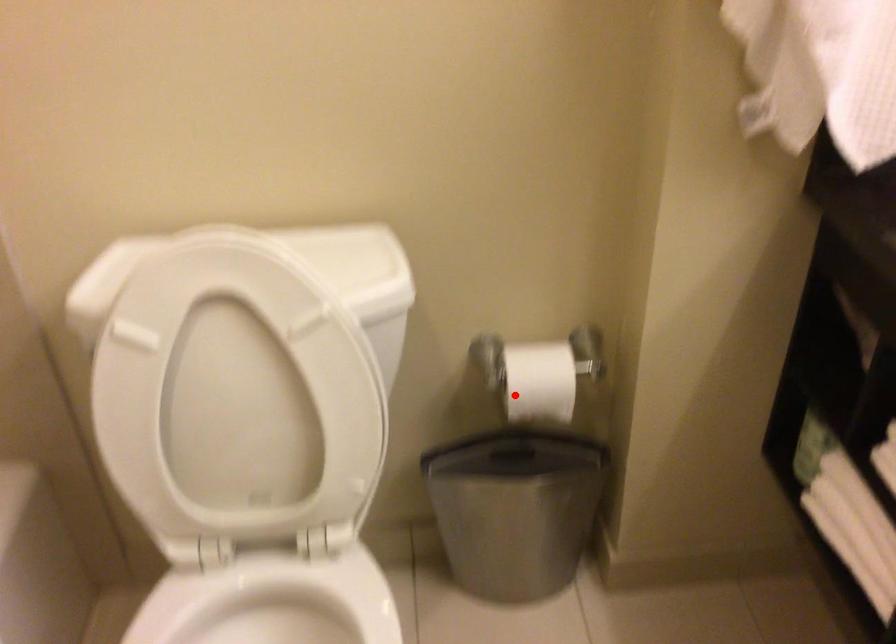
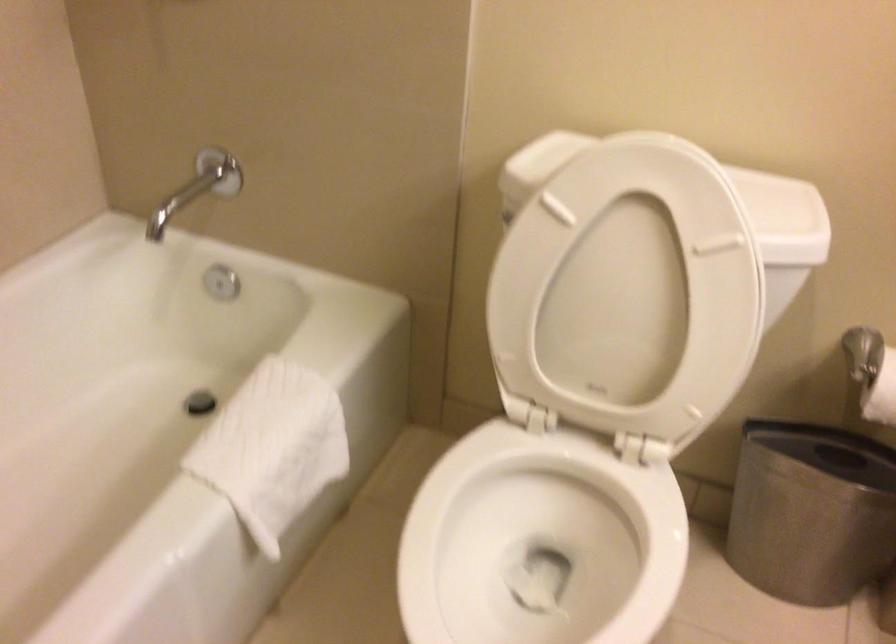
Question: I am providing you with two images of the same scene from different viewpoints. A red point is marked on the first image. At the location where the point appears in image 1, is it still visible in image 2?

Choices:
 (A) Yes
 (B) No

Answer: (A)